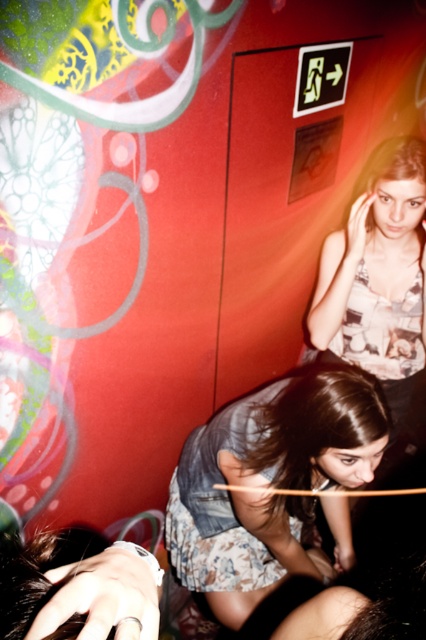
Question: Which point is closer to the camera taking this photo?

Choices:
 (A) (351, 451)
 (B) (423, 182)

Answer: (A)

Question: Does denim jacket at lower center appear on the left side of matte floral tank top at upper right?

Choices:
 (A) yes
 (B) no

Answer: (A)

Question: Which point is closer to the camera?

Choices:
 (A) denim jacket at lower center
 (B) matte floral tank top at upper right

Answer: (A)

Question: Is the position of denim jacket at lower center more distant than that of matte floral tank top at upper right?

Choices:
 (A) no
 (B) yes

Answer: (A)

Question: Can you confirm if denim jacket at lower center is positioned below matte floral tank top at upper right?

Choices:
 (A) no
 (B) yes

Answer: (B)

Question: Which object appears farthest from the camera in this image?

Choices:
 (A) matte floral tank top at upper right
 (B) denim jacket at lower center

Answer: (A)